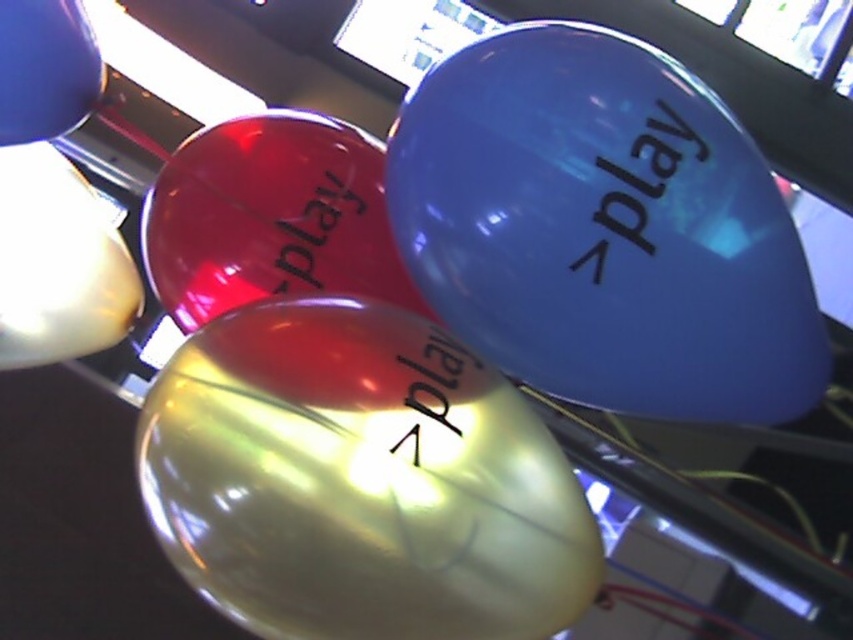
Question: Is glossy blue balloon at upper right below matte yellow balloon at left?

Choices:
 (A) yes
 (B) no

Answer: (B)

Question: Which object is the closest to the matte yellow balloon at left?

Choices:
 (A) glossy plastic play at center
 (B) glossy translucent balloon at center
 (C) glossy red play at center
 (D) glossy blue play at upper right

Answer: (B)

Question: Is the position of matte blue balloon at upper left more distant than that of glossy plastic play at center?

Choices:
 (A) no
 (B) yes

Answer: (B)

Question: Which point is farther to the camera?

Choices:
 (A) (49, 173)
 (B) (779, 260)
 (C) (415, 445)
 (D) (639, 180)

Answer: (A)

Question: Does glossy blue balloon at upper right have a larger size compared to matte blue balloon at upper left?

Choices:
 (A) no
 (B) yes

Answer: (B)

Question: Among these objects, which one is nearest to the camera?

Choices:
 (A) glossy blue balloon at upper right
 (B) matte yellow balloon at left
 (C) glossy plastic play at center

Answer: (A)